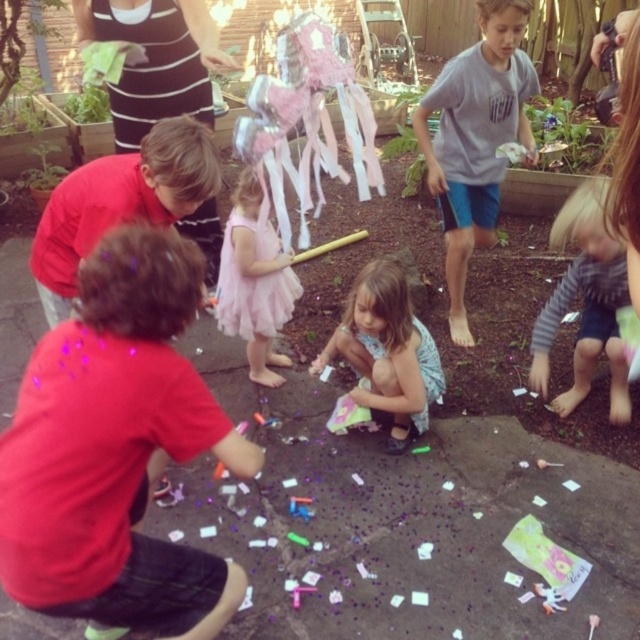
Question: Which of the following is the closest to the observer?

Choices:
 (A) (81, 428)
 (B) (460, 156)
 (C) (58, 218)
 (D) (406, 378)

Answer: (A)

Question: Which of the following is the farthest from the observer?

Choices:
 (A) blurred blonde hair at lower right
 (B) pink tulle dress at center
 (C) matte red shirt at lower left

Answer: (B)

Question: Can you confirm if matte red shirt at lower left is positioned below red matte shirt at lower left?

Choices:
 (A) no
 (B) yes

Answer: (B)

Question: Based on their relative distances, which object is farther from the matte red shirt at lower left?

Choices:
 (A) red matte shirt at lower left
 (B) gray cotton shirt at center
 (C) pink tulle dress at center

Answer: (B)

Question: Can you confirm if blurred blonde hair at lower right is positioned below pastel pink tutu at center?

Choices:
 (A) yes
 (B) no

Answer: (B)

Question: Can you confirm if gray cotton shirt at center is smaller than red matte shirt at lower left?

Choices:
 (A) no
 (B) yes

Answer: (A)